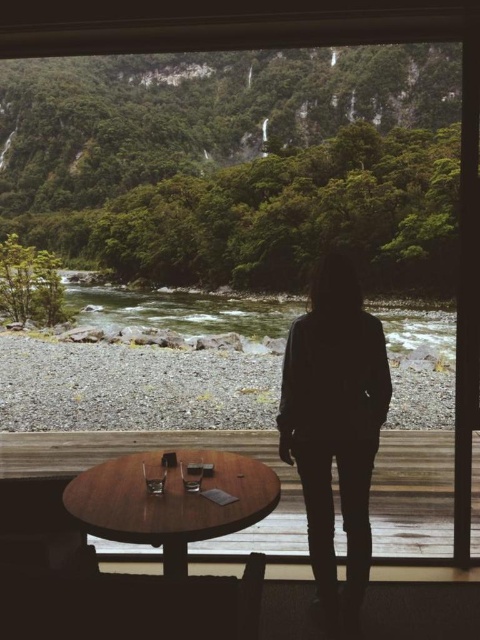
Question: Does silhouette fabric at center appear over wooden table at lower center?

Choices:
 (A) yes
 (B) no

Answer: (A)

Question: Which object appears closest to the camera in this image?

Choices:
 (A) wooden table at lower center
 (B) gray gravel river at center
 (C) silhouette fabric at center

Answer: (A)

Question: Does silhouette fabric at center appear under gray gravel river at center?

Choices:
 (A) no
 (B) yes

Answer: (B)

Question: Which object is closer to the camera taking this photo?

Choices:
 (A) gray gravel river at center
 (B) wooden table at lower center

Answer: (B)

Question: Which object is farther from the camera taking this photo?

Choices:
 (A) silhouette fabric at center
 (B) gray gravel river at center
 (C) wooden table at lower center

Answer: (B)

Question: Is the position of silhouette fabric at center less distant than that of wooden table at lower center?

Choices:
 (A) yes
 (B) no

Answer: (B)